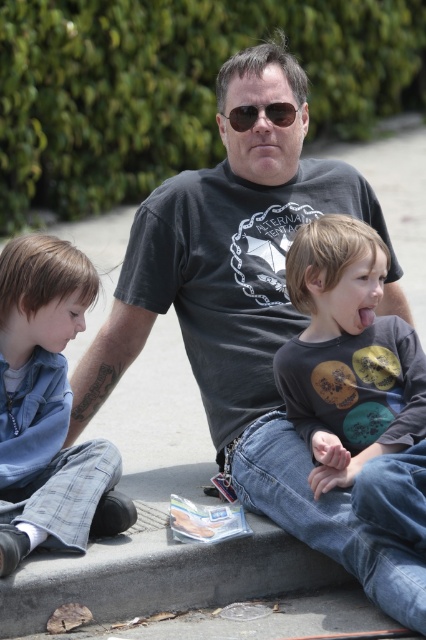
Question: Considering the real-world distances, which object is closest to the matte gray shirt at center?

Choices:
 (A) sunglasses at center
 (B) blue denim pants at lower left

Answer: (B)

Question: Considering the real-world distances, which object is closest to the matte gray shirt at center?

Choices:
 (A) sunglasses at center
 (B) blue denim pants at lower left

Answer: (B)

Question: Can you confirm if blue denim pants at lower left is wider than sunglasses at center?

Choices:
 (A) no
 (B) yes

Answer: (B)

Question: Which point is farther from the camera taking this photo?

Choices:
 (A) (340, 444)
 (B) (11, 497)

Answer: (A)

Question: Can you confirm if matte gray shirt at center is bigger than sunglasses at center?

Choices:
 (A) no
 (B) yes

Answer: (B)

Question: Is matte gray shirt at center thinner than sunglasses at center?

Choices:
 (A) no
 (B) yes

Answer: (A)